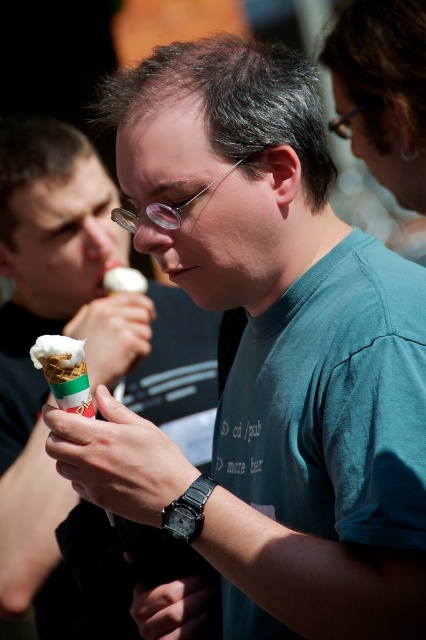
You are a photographer trying to capture a clear shot of the white creamy ice cream cone at left and the metallic frame glasses at upper center. Which object is wider in the image?

The white creamy ice cream cone at left is wider than the metallic frame glasses at upper center.

You are trying to find the clear plastic glasses at center. Where would you look relative to the metallic frame glasses at upper center?

The clear plastic glasses at center are located below the metallic frame glasses at upper center.

You are a photographer trying to capture a closeup of the white creamy ice cream cone at left and the metallic frame glasses at upper center in the scene. Given the distance between them, can you fit both subjects into a single frame without moving either object?

The distance between the white creamy ice cream cone at left and the metallic frame glasses at upper center is 3.61 feet. Depending on the camera lens and framing, it may be possible to include both in the shot, but the significant distance might require a wider angle or adjusting the composition to ensure both are visible.